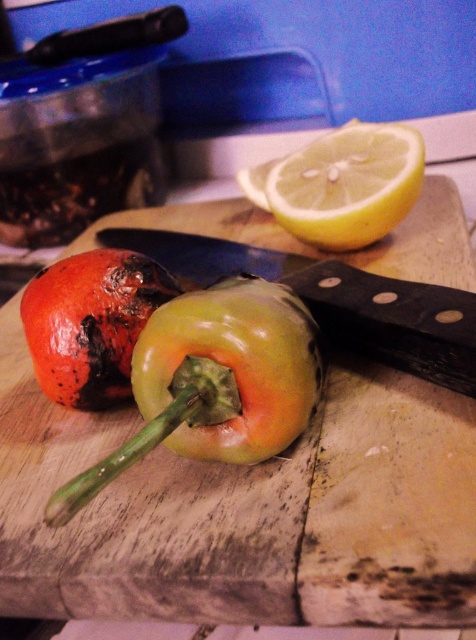
You are preparing a salad and need to chop the green matte bell pepper at center. To do this, you place it on the wooden cutting board at center. Will the pepper remain stable on the board?

The wooden cutting board at center has a greater height compared to green matte bell pepper at center, so the pepper will remain stable on the board.

Looking at this image, you are looking at the wooden cutting board with the peppers and knife. There are two points marked on the board at coordinates point (419,292) and point (389,227). Which point is closer to you?

Point (419,292) is closer to the viewer than point (389,227).